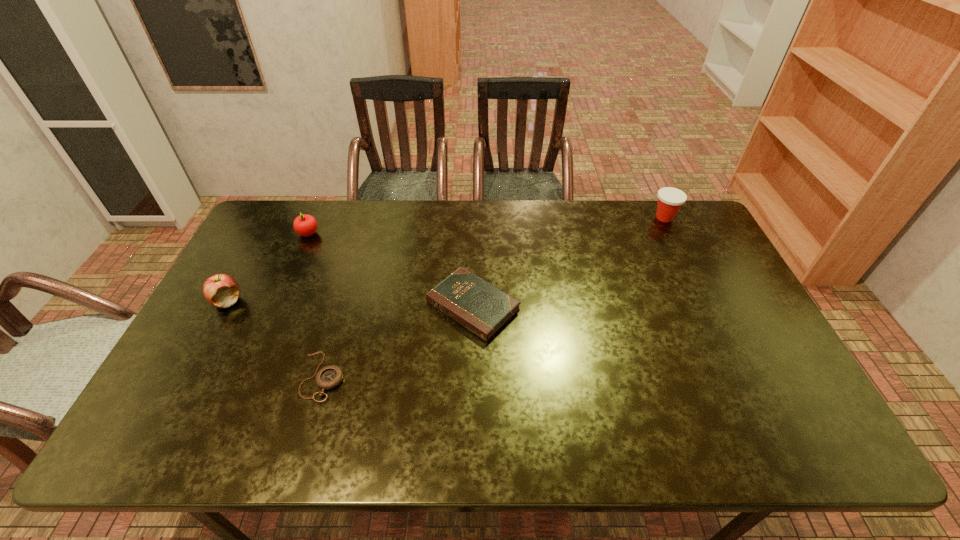
Where is `vacant space at the far edge of the desktop`? vacant space at the far edge of the desktop is located at coordinates (378, 205).

In the image, there is a desktop. Find the location of `vacant space at the near edge`. vacant space at the near edge is located at coordinates (466, 421).

You are a GUI agent. You are given a task and a screenshot of the screen. Output one action in this format:
    pyautogui.click(x=<x>, y=<y>)
    Task: Click on the vacant space at the left edge
    The image size is (960, 540).
    Given the screenshot: What is the action you would take?
    pyautogui.click(x=213, y=401)

Locate an element on the screen. Image resolution: width=960 pixels, height=540 pixels. free space at the right edge of the desktop is located at coordinates (743, 293).

Image resolution: width=960 pixels, height=540 pixels. I want to click on free space at the far right corner, so click(x=667, y=230).

Where is `free space between the nearer apple and the Dixie cup`? This screenshot has height=540, width=960. free space between the nearer apple and the Dixie cup is located at coordinates (446, 259).

Image resolution: width=960 pixels, height=540 pixels. What are the coordinates of `vacant space that is in between the rightmost object and the nearer apple` in the screenshot? It's located at (446, 259).

The image size is (960, 540). I want to click on empty location between the left apple and the farther apple, so click(268, 267).

At what (x,y) coordinates should I click in order to perform the action: click on vacant space in between the fourth object from left to right and the third object from right to left. Please return your answer as a coordinate pair (x, y). The width and height of the screenshot is (960, 540). Looking at the image, I should click on (397, 341).

Image resolution: width=960 pixels, height=540 pixels. In order to click on free point between the farthest object and the left apple in this screenshot , I will do `click(446, 259)`.